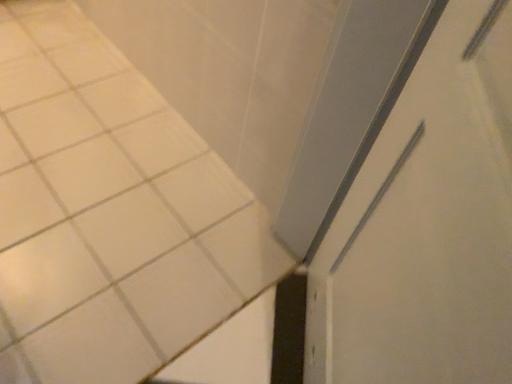
Measure the distance between white glossy tile at upper left and camera.

38.08 inches.

This screenshot has height=384, width=512. What do you see at coordinates (109, 212) in the screenshot?
I see `white glossy tile at upper left` at bounding box center [109, 212].

Identify the location of white glossy tile at upper left. (109, 212).

You are a GUI agent. You are given a task and a screenshot of the screen. Output one action in this format:
    pyautogui.click(x=<x>, y=<y>)
    Task: Click on the white glossy tile at upper left
    This screenshot has height=384, width=512.
    Given the screenshot: What is the action you would take?
    pyautogui.click(x=109, y=212)